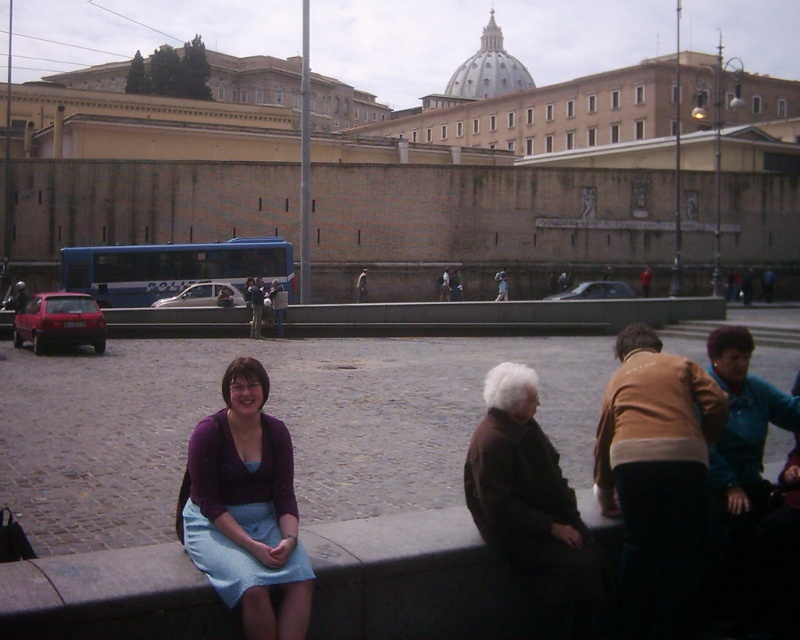
You are standing in the public square and want to find the purple fabric skirt at lower left. According to the coordinates provided, where should you look relative to the center of the image?

The purple fabric skirt at lower left is located at coordinates point 0.795 on the x axis and 0.309 on the y axis, which places it to the right and slightly below the center of the image.

You are a photographer standing at the camera position. You want to capture a closeup shot of the purple fabric skirt at lower left without moving the camera. Can you zoom in enough to get a clear closeup?

The purple fabric skirt at lower left is 3.67 meters away from the camera. If your zoom lens can focus at that distance, then yes, you can get a clear closeup without moving the camera.

You are a photographer setting up a tripod in the public square. You notice the purple fabric skirt at lower left and the brown woolen sweater at lower right in your frame. Which object should you adjust your camera angle to focus on if you want to capture the taller one?

The brown woolen sweater at lower right is taller than the purple fabric skirt at lower left, so you should adjust your camera angle to focus on the brown woolen sweater at lower right.